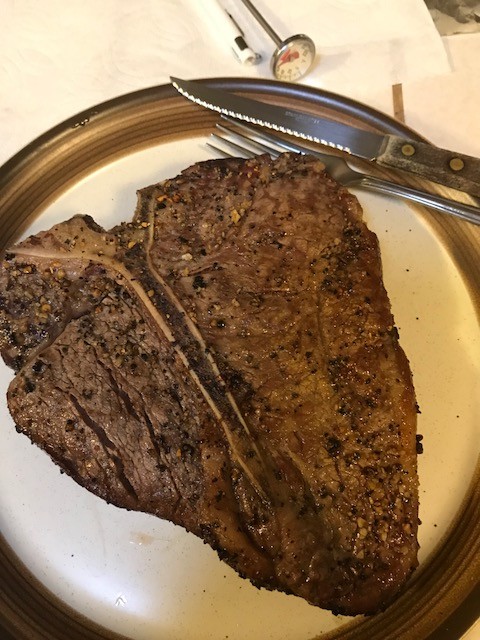
Where is `silverware`? The width and height of the screenshot is (480, 640). silverware is located at coordinates (428, 154), (415, 196).